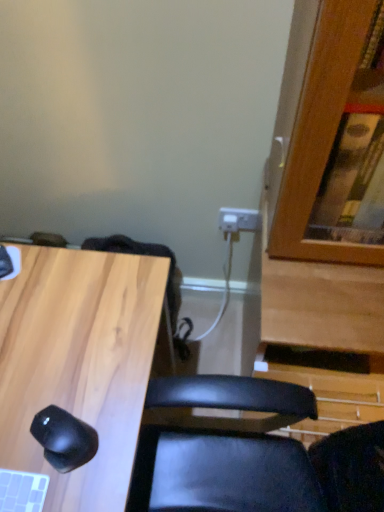
Find the location of a particular element. vacant space that is to the left of black matte mouse at lower left is located at coordinates (18, 430).